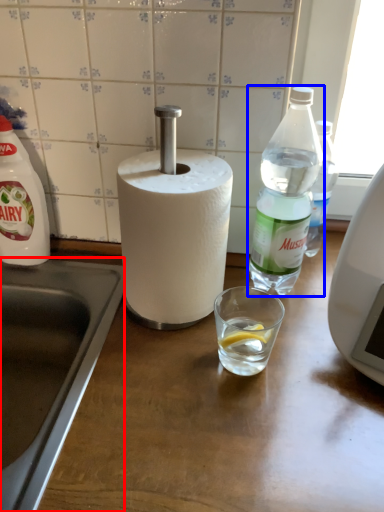
Question: Which of the following is the closest to the observer, sink (highlighted by a red box) or bottle (highlighted by a blue box)?

Choices:
 (A) sink
 (B) bottle

Answer: (A)